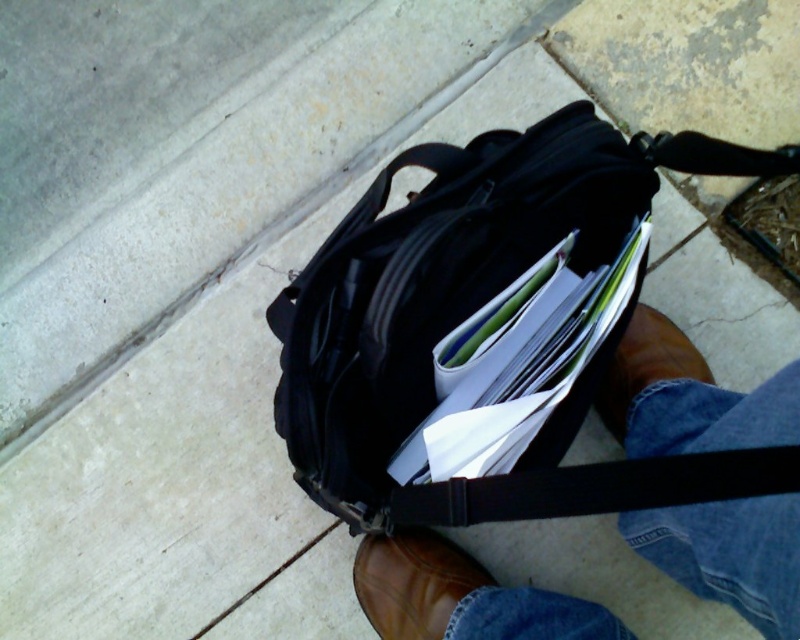
Locate an element on the screen. black matte bag at center is located at coordinates (492, 332).

Is the position of black matte bag at center more distant than that of brown leather shoe at lower center?

No.

Is point (344, 385) positioned after point (396, 573)?

No, (344, 385) is closer to viewer.

At what (x,y) coordinates should I click in order to perform the action: click on black matte bag at center. Please return your answer as a coordinate pair (x, y). Looking at the image, I should click on (492, 332).

Does brown leather shoe at lower center have a lesser width compared to brown leather boot at lower center?

No.

Is point (468, 554) positioned behind point (660, 342)?

That is True.

Where is `brown leather shoe at lower center`? brown leather shoe at lower center is located at coordinates (413, 582).

Who is positioned more to the right, brown leather boots at lower center or brown leather boot at lower center?

Positioned to the right is brown leather boot at lower center.

Is brown leather boots at lower center closer to the viewer compared to brown leather boot at lower center?

Yes, brown leather boots at lower center is in front of brown leather boot at lower center.

Who is more distant from viewer, (380, 545) or (637, 358)?

Point (637, 358)

You are a GUI agent. You are given a task and a screenshot of the screen. Output one action in this format:
    pyautogui.click(x=<x>, y=<y>)
    Task: Click on the brown leather boots at lower center
    
    Given the screenshot: What is the action you would take?
    pyautogui.click(x=688, y=396)